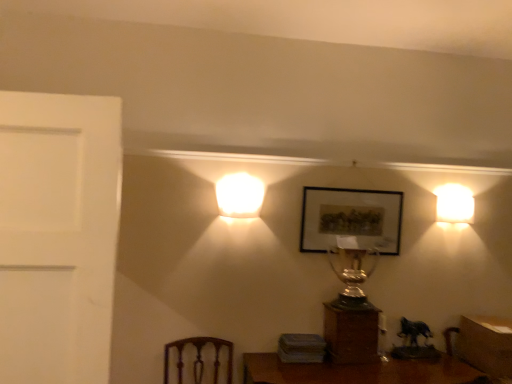
Find the location of `matte black picture frame at center`. matte black picture frame at center is located at coordinates (351, 218).

Image resolution: width=512 pixels, height=384 pixels. In order to click on white glossy wall sconce at right, the first lamp positioned from the right in this screenshot , I will do `click(454, 203)`.

This screenshot has width=512, height=384. What do you see at coordinates (239, 195) in the screenshot?
I see `white glossy lampshade at center, acting as the second lamp starting from the back` at bounding box center [239, 195].

Locate an element on the screen. The height and width of the screenshot is (384, 512). matte black picture frame at center is located at coordinates (351, 218).

Consider the image. Is wooden trophy at center taller than white glossy wall sconce at right, the first lamp positioned from the right?

Yes.

Can white glossy wall sconce at right, which appears as the 2th lamp when viewed from the left, be found inside wooden trophy at center?

No.

Is there a large distance between wooden trophy at center and white glossy wall sconce at right, the 1th lamp in the back-to-front sequence?

Indeed, wooden trophy at center is not near white glossy wall sconce at right, the 1th lamp in the back-to-front sequence.

In the scene shown: Is matte black picture frame at center shorter than white glossy lampshade at center, the 2th lamp positioned from the right?

No, matte black picture frame at center is not shorter than white glossy lampshade at center, the 2th lamp positioned from the right.

Which point is more distant from viewer, (352,193) or (247,201)?

The point (352,193) is farther from the camera.

Is matte black picture frame at center in contact with white glossy lampshade at center, the first lamp when ordered from front to back?

No, matte black picture frame at center is not next to white glossy lampshade at center, the first lamp when ordered from front to back.

Based on the photo, considering the relative sizes of matte black picture frame at center and white glossy lampshade at center, the first lamp when ordered from front to back, in the image provided, is matte black picture frame at center wider than white glossy lampshade at center, the first lamp when ordered from front to back,?

Incorrect, the width of matte black picture frame at center does not surpass that of white glossy lampshade at center, the first lamp when ordered from front to back.

From the image's perspective, is wooden table at lower right below matte black picture frame at center?

Yes, from the image's perspective, wooden table at lower right is beneath matte black picture frame at center.

Looking at this image, considering the relative sizes of wooden table at lower right and matte black picture frame at center in the image provided, is wooden table at lower right taller than matte black picture frame at center?

Incorrect, the height of wooden table at lower right is not larger of that of matte black picture frame at center.

From a real-world perspective, is wooden table at lower right above or below matte black picture frame at center?

Clearly, from a real-world perspective, wooden table at lower right is below matte black picture frame at center.

Considering the points (459, 339) and (335, 323), which point is behind, point (459, 339) or point (335, 323)?

The point (459, 339) is farther.

From the image's perspective, between wooden table at lower right and wooden trophy at center, which one is located above?

wooden trophy at center appears higher in the image.

Considering the positions of objects wooden table at lower right and wooden trophy at center in the image provided, who is more to the right, wooden table at lower right or wooden trophy at center?

From the viewer's perspective, wooden table at lower right appears more on the right side.

Are wooden table at lower right and wooden trophy at center located far from each other?

No, wooden table at lower right is in close proximity to wooden trophy at center.

Which object is positioned more to the left, white glossy wall sconce at right, the first lamp positioned from the right, or shiny gold trophy at center?

shiny gold trophy at center is more to the left.

Would you say white glossy wall sconce at right, which ranks as the second lamp in front-to-back order, is inside or outside shiny gold trophy at center?

white glossy wall sconce at right, which ranks as the second lamp in front-to-back order, is outside shiny gold trophy at center.

Can you see white glossy wall sconce at right, which ranks as the second lamp in front-to-back order, touching shiny gold trophy at center?

No, white glossy wall sconce at right, which ranks as the second lamp in front-to-back order, is not with shiny gold trophy at center.

Image resolution: width=512 pixels, height=384 pixels. What are the coordinates of `picture frame on the right side of wooden trophy at center` in the screenshot? It's located at point(351,218).

Is matte black picture frame at center at the right side of wooden trophy at center?

Yes.

Is matte black picture frame at center turned away from wooden trophy at center?

No, matte black picture frame at center is not facing away from wooden trophy at center.

Is matte black picture frame at center next to wooden trophy at center?

No, matte black picture frame at center is not in contact with wooden trophy at center.

Are white glossy wall sconce at right, the 1th lamp in the back-to-front sequence, and wooden table at lower right beside each other?

No, white glossy wall sconce at right, the 1th lamp in the back-to-front sequence, is not beside wooden table at lower right.

From the image's perspective, who appears lower, white glossy wall sconce at right, the 1th lamp in the back-to-front sequence, or wooden table at lower right?

wooden table at lower right appears lower in the image.

Based on the photo, in terms of height, does white glossy wall sconce at right, the first lamp positioned from the right, look taller or shorter compared to wooden table at lower right?

Considering their sizes, white glossy wall sconce at right, the first lamp positioned from the right, has less height than wooden table at lower right.

In the image, is white glossy wall sconce at right, the first lamp positioned from the right, on the left side or the right side of wooden table at lower right?

Clearly, white glossy wall sconce at right, the first lamp positioned from the right, is on the left of wooden table at lower right in the image.

Identify the location of furniture lying below the white glossy wall sconce at right, the 1th lamp in the back-to-front sequence (from the image's perspective). The width and height of the screenshot is (512, 384). (351, 333).

The width and height of the screenshot is (512, 384). In order to click on the 1st lamp positioned above the matte black picture frame at center (from a real-world perspective) in this screenshot , I will do `click(239, 195)`.

Looking at the image, which one is located closer to wooden table at lower right, white glossy lampshade at center, marked as the first lamp in a left-to-right arrangement, or wooden trophy at center?

wooden trophy at center is positioned closer to the anchor wooden table at lower right.

Based on their spatial positions, is white glossy lampshade at center, the first lamp when ordered from front to back, or white glossy wall sconce at right, the 1th lamp in the back-to-front sequence, further from wooden table at lower right?

white glossy lampshade at center, the first lamp when ordered from front to back, is positioned further to the anchor wooden table at lower right.

From the picture: When comparing their distances from matte black picture frame at center, does wooden trophy at center or white glossy lampshade at center, the first lamp when ordered from front to back, seem closer?

wooden trophy at center is closer to matte black picture frame at center.

Considering their positions, is shiny gold trophy at center positioned further to wooden trophy at center than matte black picture frame at center?

matte black picture frame at center.

Based on their spatial positions, is wooden table at lower right or matte black picture frame at center further from wooden trophy at center?

The object further to wooden trophy at center is wooden table at lower right.

In the scene shown: Based on their spatial positions, is shiny gold trophy at center or matte black picture frame at center closer to white glossy lampshade at center, the first lamp when ordered from front to back?

Based on the image, matte black picture frame at center appears to be nearer to white glossy lampshade at center, the first lamp when ordered from front to back.

Consider the image. When comparing their distances from white glossy wall sconce at right, the first lamp positioned from the right, does matte black picture frame at center or wooden table at lower right seem closer?

matte black picture frame at center lies closer to white glossy wall sconce at right, the first lamp positioned from the right, than the other object.

When comparing their distances from matte black picture frame at center, does shiny gold trophy at center or white glossy wall sconce at right, which appears as the 2th lamp when viewed from the left, seem closer?

shiny gold trophy at center.

Find the location of a particular element. Image resolution: width=512 pixels, height=384 pixels. table lamp situated between white glossy lampshade at center, the first lamp when ordered from front to back, and matte black picture frame at center from left to right is located at coordinates coord(352,273).

You are a GUI agent. You are given a task and a screenshot of the screen. Output one action in this format:
    pyautogui.click(x=<x>, y=<y>)
    Task: Click on the picture frame situated between wooden trophy at center and wooden table at lower right from left to right
    
    Given the screenshot: What is the action you would take?
    351,218

Image resolution: width=512 pixels, height=384 pixels. Identify the location of picture frame between shiny gold trophy at center and wooden table at lower right in the horizontal direction. (351, 218).

The width and height of the screenshot is (512, 384). In order to click on picture frame between white glossy lampshade at center, marked as the first lamp in a left-to-right arrangement, and wooden table at lower right, in the horizontal direction in this screenshot , I will do `click(351, 218)`.